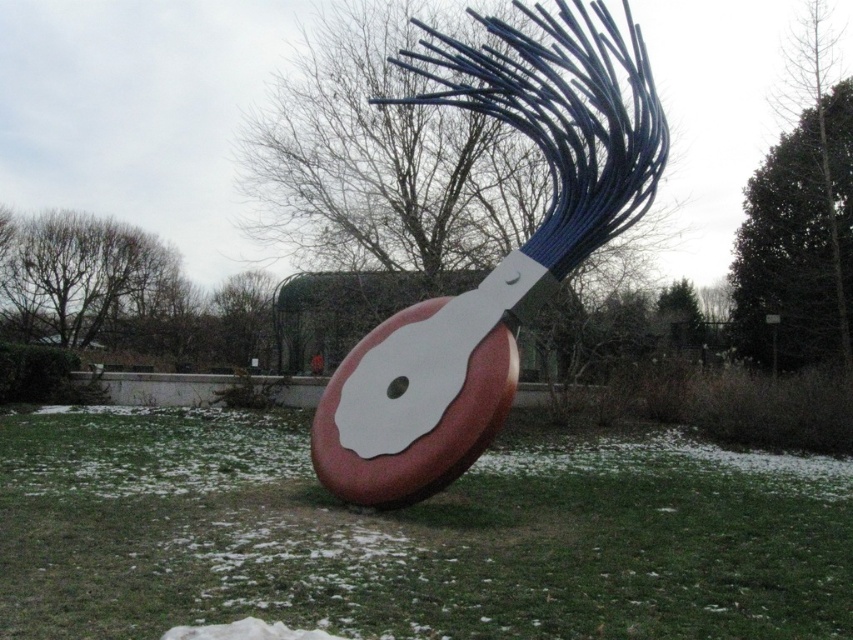
You are standing in the park and see the green grass at center and the matte red and white sculpture at center. Which object is positioned to the left of the other?

The green grass at center is to the left of the matte red and white sculpture at center.

You are a gardener who wants to plant flowers around the matte red and white sculpture at center. The flowers require a minimum of 15 feet of space between them and the sculpture to grow properly. Based on the scene, can you determine if the existing green grass at center is far enough away to accommodate the flowers?

The distance between the green grass at center and the matte red and white sculpture at center is 18.16 feet, which exceeds the required 15 feet. Therefore, the existing green grass at center is far enough away to accommodate the flowers.

You are standing at the origin point of the coordinate system. The sculpture is located at the origin. You want to walk to the green grass at center. In which direction should you walk?

You should walk towards the direction of the coordinate point (412, 538) to reach the green grass at center.